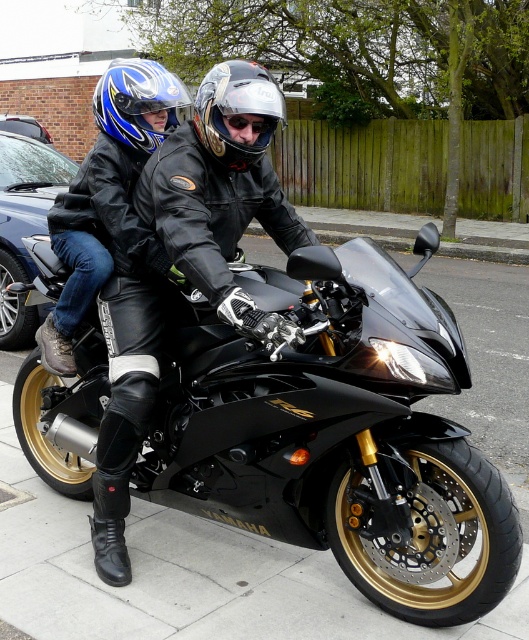
Question: Which object is the closest to the black glossy car at left?

Choices:
 (A) matte black jacket at center
 (B) black leather jacket at center

Answer: (A)

Question: Does matte black jacket at center have a larger size compared to glossy metallic helmet at center?

Choices:
 (A) yes
 (B) no

Answer: (A)

Question: Is black matte motorcycle at center to the left of blue glossy helmet at upper left from the viewer's perspective?

Choices:
 (A) no
 (B) yes

Answer: (A)

Question: Which point is closer to the camera taking this photo?

Choices:
 (A) (263, 116)
 (B) (269, 138)
 (C) (117, 97)

Answer: (A)

Question: Can you confirm if matte black jacket at center is bigger than glossy plastic goggles at center?

Choices:
 (A) no
 (B) yes

Answer: (B)

Question: Which of these objects is positioned closest to the matte black jacket at center?

Choices:
 (A) black glossy car at left
 (B) blue glossy helmet at upper left
 (C) black matte motorcycle at center
 (D) glossy metallic helmet at center

Answer: (B)